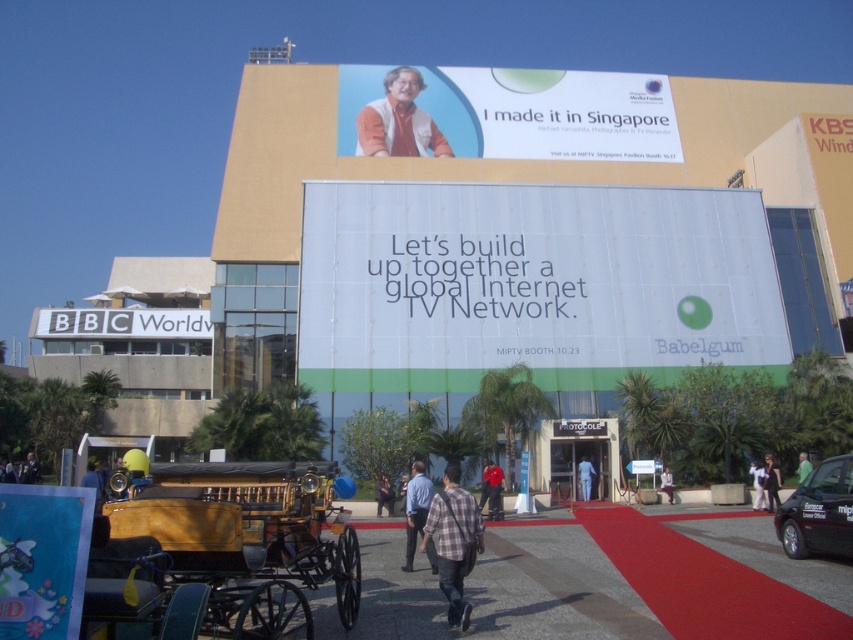
Question: Is matte plastic billboard at upper center closer to camera compared to white fabric person at lower right?

Choices:
 (A) yes
 (B) no

Answer: (B)

Question: Among these objects, which one is farthest from the camera?

Choices:
 (A) plaid fabric shirt at center
 (B) black leather jacket at lower right
 (C) light blue shirt at center
 (D) white fabric person at lower right

Answer: (D)

Question: Is wooden polished cart at lower left behind matte plastic billboard at upper center?

Choices:
 (A) no
 (B) yes

Answer: (A)

Question: Is black glossy car at lower right below green fabric person at center?

Choices:
 (A) no
 (B) yes

Answer: (A)

Question: Which object is closer to the camera taking this photo?

Choices:
 (A) wooden polished cart at lower left
 (B) red smooth shirt at center
 (C) white fabric person at lower right

Answer: (A)

Question: Which object appears farthest from the camera in this image?

Choices:
 (A) black leather jacket at lower right
 (B) red smooth shirt at center
 (C) dark blue shirt at center
 (D) white paper billboard at center

Answer: (D)